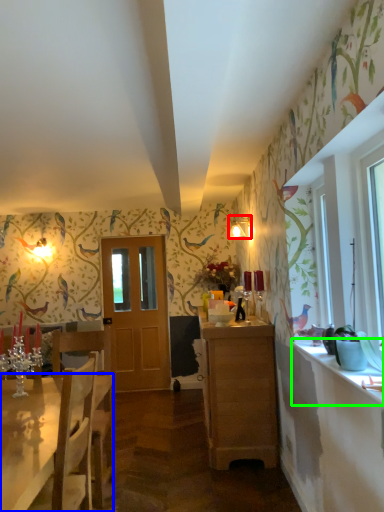
Question: Which is nearer to the lamp (highlighted by a red box)? desk (highlighted by a blue box) or counter top (highlighted by a green box).

Choices:
 (A) desk
 (B) counter top

Answer: (B)